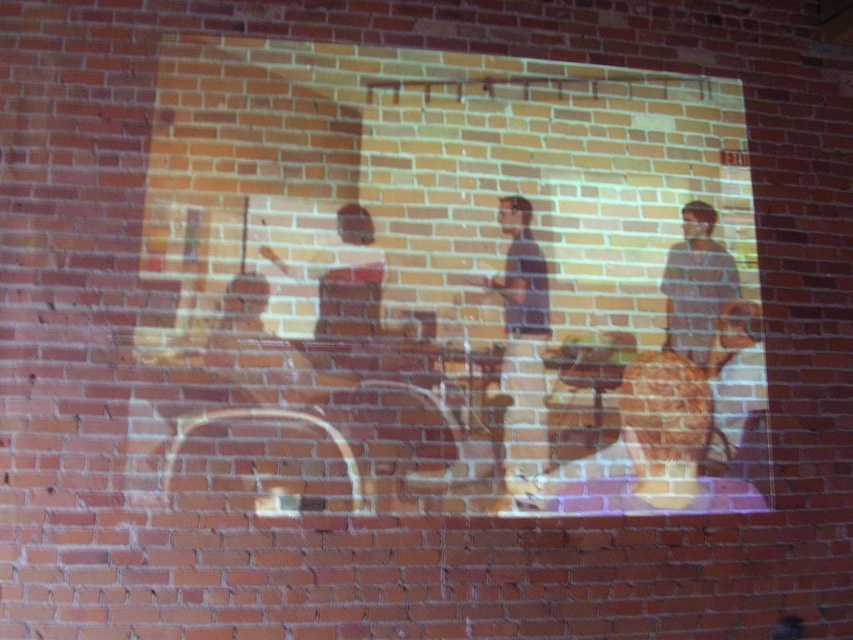
Which of these two, dark blue shirt at center or striped shirt at right, stands shorter?

With less height is striped shirt at right.

Is point (527, 230) in front of point (698, 212)?

That is True.

The width and height of the screenshot is (853, 640). I want to click on dark blue shirt at center, so click(521, 342).

Which of these two, matte brown guitar at center or matte brown guitar at right, stands shorter?

matte brown guitar at right

Measure the distance between matte brown guitar at center and matte brown guitar at right.

matte brown guitar at center is 9.49 centimeters from matte brown guitar at right.

Which is in front, point (679, 417) or point (723, 413)?

Positioned in front is point (679, 417).

Find the location of `matte brown guitar at center`. matte brown guitar at center is located at coordinates (677, 445).

Between matte brown guitar at center and dark blue shirt at center, which one has more height?

Standing taller between the two is dark blue shirt at center.

Describe the element at coordinates (677, 445) in the screenshot. I see `matte brown guitar at center` at that location.

You are a GUI agent. You are given a task and a screenshot of the screen. Output one action in this format:
    pyautogui.click(x=<x>, y=<y>)
    Task: Click on the matte brown guitar at center
    Image resolution: width=853 pixels, height=640 pixels.
    Given the screenshot: What is the action you would take?
    pyautogui.click(x=677, y=445)